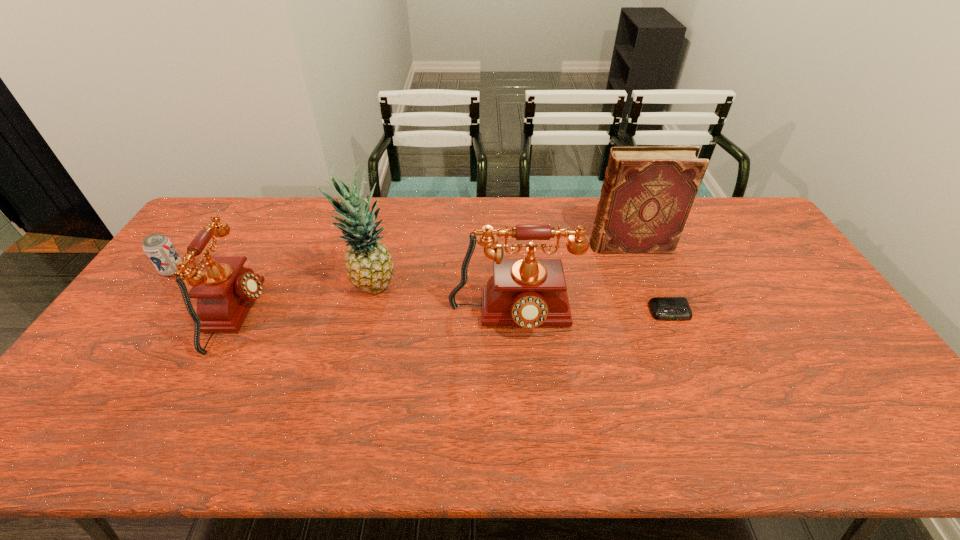
I want to click on the left telephone, so click(225, 290).

The height and width of the screenshot is (540, 960). Identify the location of the second object from left to right. (225, 290).

You are a GUI agent. You are given a task and a screenshot of the screen. Output one action in this format:
    pyautogui.click(x=<x>, y=<y>)
    Task: Click on the right telephone
    
    Given the screenshot: What is the action you would take?
    [x=529, y=292]

Find the location of a particular element. the taller telephone is located at coordinates (529, 292).

The image size is (960, 540). Find the location of `beer can`. beer can is located at coordinates (159, 249).

This screenshot has width=960, height=540. What are the coordinates of `the leftmost object` in the screenshot? It's located at (159, 249).

Where is `pineapple`? pineapple is located at coordinates (369, 266).

At what (x,y) coordinates should I click in order to perform the action: click on hardback book. Please return your answer as a coordinate pair (x, y). Looking at the image, I should click on (648, 191).

You are a GUI agent. You are given a task and a screenshot of the screen. Output one action in this format:
    pyautogui.click(x=<x>, y=<y>)
    Task: Click on the shortest object
    
    Given the screenshot: What is the action you would take?
    pyautogui.click(x=662, y=308)

At what (x,y) coordinates should I click in order to perform the action: click on free space located 0.050m on the dial of the shorter telephone. Please return your answer as a coordinate pair (x, y). This screenshot has height=540, width=960. Looking at the image, I should click on (281, 315).